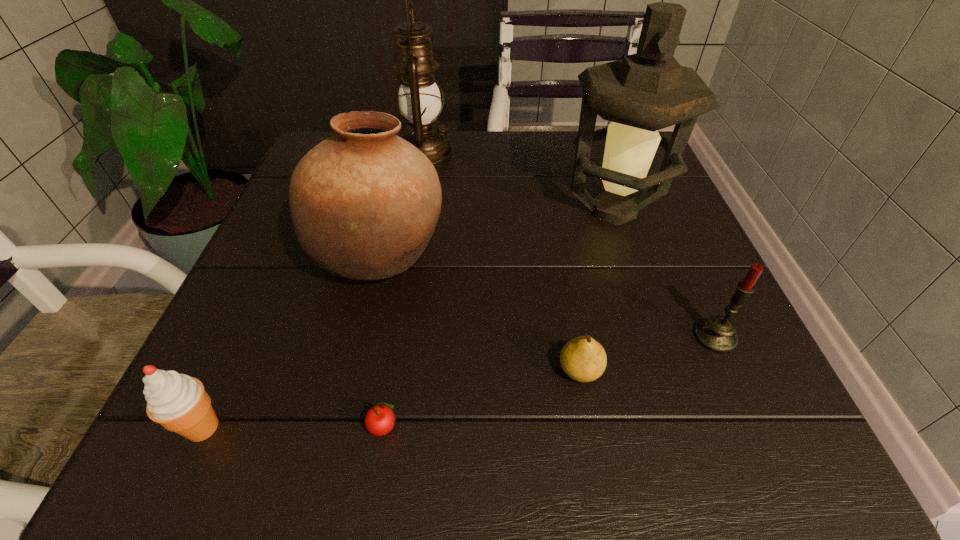
The width and height of the screenshot is (960, 540). What are the coordinates of `unoccupied position between the leftmost object and the candle` in the screenshot? It's located at (459, 382).

I want to click on unoccupied position between the leftmost object and the candle, so [x=459, y=382].

Image resolution: width=960 pixels, height=540 pixels. I want to click on vacant space in between the cherry and the icecream, so click(x=294, y=428).

The image size is (960, 540). Identify the location of free area in between the nearer oil lamp and the farther oil lamp. (519, 181).

You are a GUI agent. You are given a task and a screenshot of the screen. Output one action in this format:
    pyautogui.click(x=<x>, y=<y>)
    Task: Click on the free space between the cherry and the pear
    The width and height of the screenshot is (960, 540).
    Given the screenshot: What is the action you would take?
    pyautogui.click(x=483, y=399)

Where is `unoccupied position between the farther oil lamp and the candle`? This screenshot has width=960, height=540. unoccupied position between the farther oil lamp and the candle is located at coordinates (570, 244).

At what (x,y) coordinates should I click in order to perform the action: click on empty location between the left oil lamp and the candle. Please return your answer as a coordinate pair (x, y). Looking at the image, I should click on (570, 244).

Identify the location of object that is the sixth closest to the candle. Image resolution: width=960 pixels, height=540 pixels. (178, 402).

Identify which object is located as the fourth nearest to the third tallest object. Please provide its 2D coordinates. Your answer should be formatted as a tuple, i.e. [(x, y)], where the tuple contains the x and y coordinates of a point satisfying the conditions above.

[(583, 359)]

Where is `blank space that satisfies the following two spatial constraints: 1. on the front side of the pottery; 2. on the right side of the cherry`? Image resolution: width=960 pixels, height=540 pixels. blank space that satisfies the following two spatial constraints: 1. on the front side of the pottery; 2. on the right side of the cherry is located at coordinates 342,428.